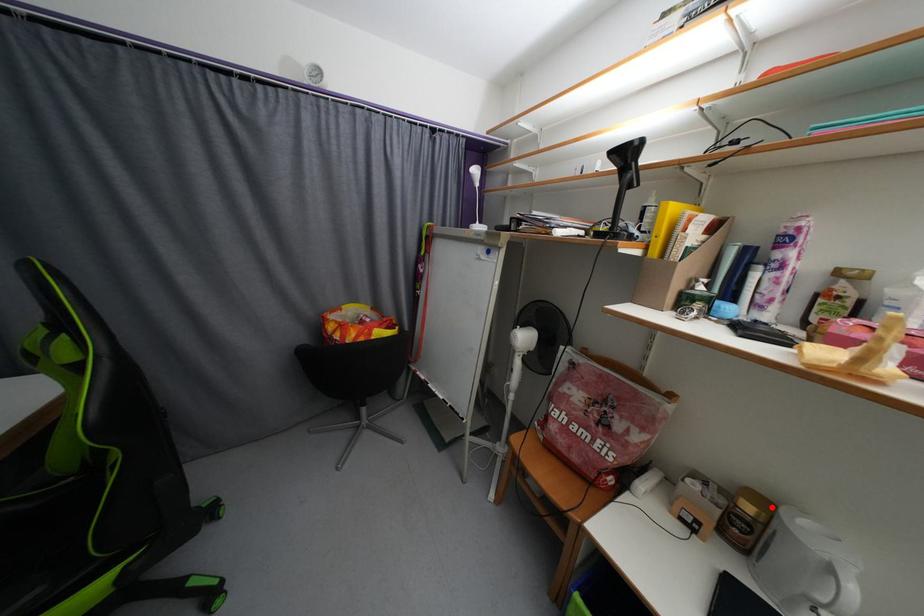
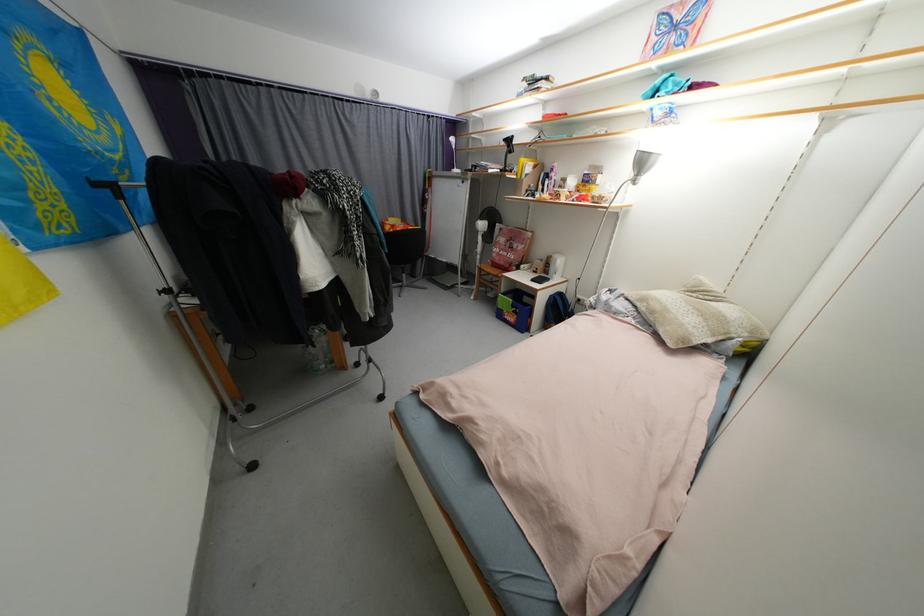
In the second image, find the point that corresponds to the highlighted location in the first image.

(557, 257)